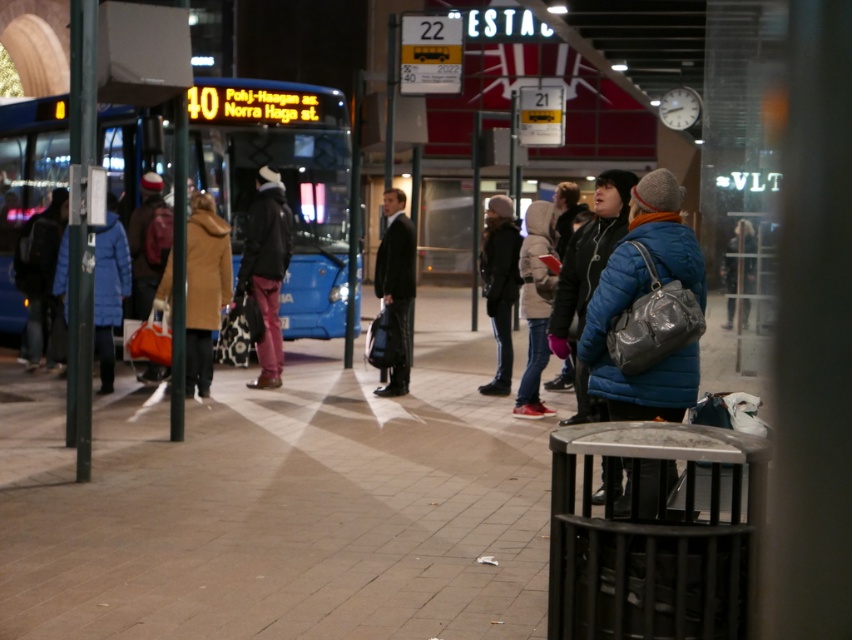
Question: Which point appears farthest from the camera in this image?

Choices:
 (A) (280, 243)
 (B) (320, 307)

Answer: (B)

Question: Is matte black jacket at center closer to the viewer compared to dark gray suit at center?

Choices:
 (A) yes
 (B) no

Answer: (B)

Question: Which point is closer to the camera taking this photo?

Choices:
 (A) (98, 294)
 (B) (222, 227)

Answer: (A)

Question: Which point is closer to the camera?

Choices:
 (A) brown wool coat at center
 (B) blue quilted jacket at center
 (C) blue matte bus at left
 (D) black metal trash can at lower right

Answer: (D)

Question: Can you confirm if blue matte bus at left is positioned above matte black jacket at center?

Choices:
 (A) no
 (B) yes

Answer: (B)

Question: Does black metal trash can at lower right have a greater width compared to blue quilted jacket at center?

Choices:
 (A) no
 (B) yes

Answer: (B)